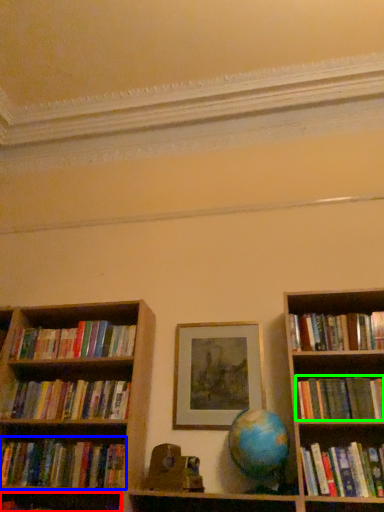
Question: Which object is the farthest from book (highlighted by a red box)? Choose among these: book (highlighted by a blue box) or book (highlighted by a green box).

Choices:
 (A) book
 (B) book

Answer: (B)